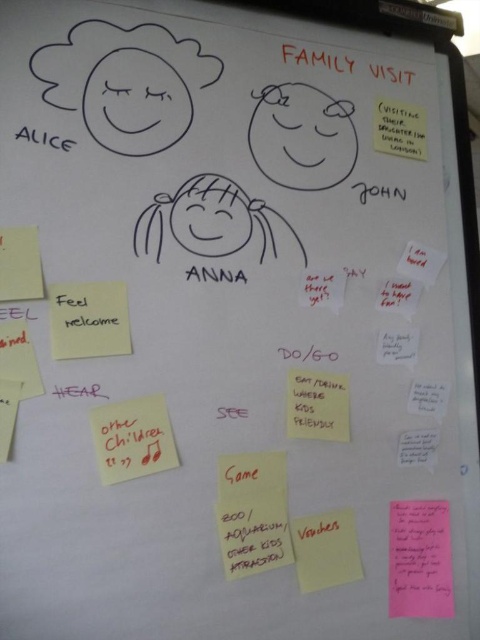
You are organizing a family trip and need to check the notes on the whiteboard. You have to retrieve the pink paper note at lower right and the yellow paper at center. Which note should you pick up first to avoid bending over too much?

The pink paper note at lower right is further to the viewer than yellow paper at center, so you should pick up the pink paper note at lower right first as it is closer to you.

You are organizing a family trip and need to prioritize tasks on the whiteboard. You see the white paper note at right and the white paper note at lower right. Which note is positioned higher on the whiteboard?

The white paper note at right is positioned higher on the whiteboard than the white paper note at lower right.

You are organizing a family trip and need to place a new sticky note on the whiteboard. The pink paper note at lower right and the yellow paper at center are already there. Which note has a larger width?

The pink paper note at lower right has a larger width than the yellow paper at center.